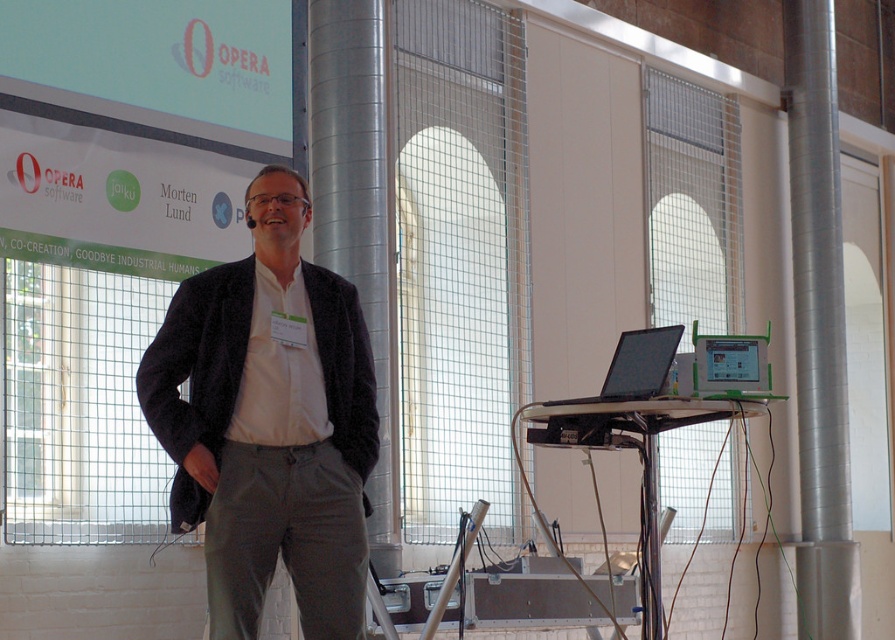
Can you confirm if matte white screen at upper left is positioned to the right of black glossy laptop at right?

In fact, matte white screen at upper left is to the left of black glossy laptop at right.

Who is more distant from viewer, (201, 76) or (671, 339)?

The point (201, 76) is more distant.

Locate an element on the screen. matte white screen at upper left is located at coordinates (158, 64).

Looking at this image, which is more to the left, silver metallic pillar at center or black glossy laptop at right?

silver metallic pillar at center

Is silver metallic pillar at center to the left of black glossy laptop at right from the viewer's perspective?

Correct, you'll find silver metallic pillar at center to the left of black glossy laptop at right.

Is point (324, 90) closer to camera compared to point (625, 333)?

No, (324, 90) is behind (625, 333).

Identify the location of silver metallic pillar at center. This screenshot has width=895, height=640. (356, 204).

Can you confirm if silver metallic pillar at right is wider than black glossy laptop at right?

No.

This screenshot has height=640, width=895. What do you see at coordinates (819, 326) in the screenshot?
I see `silver metallic pillar at right` at bounding box center [819, 326].

Find the location of a particular element. The height and width of the screenshot is (640, 895). silver metallic pillar at right is located at coordinates (819, 326).